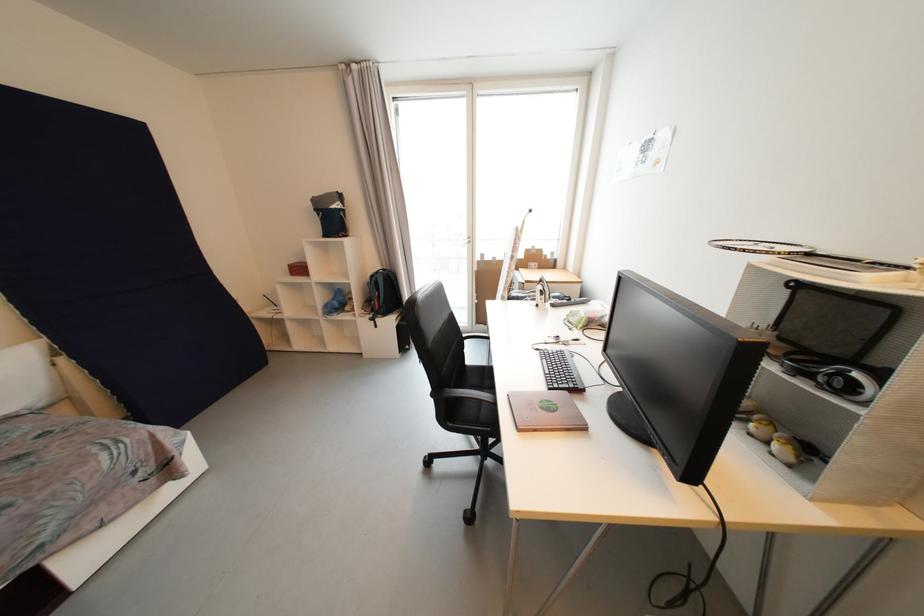
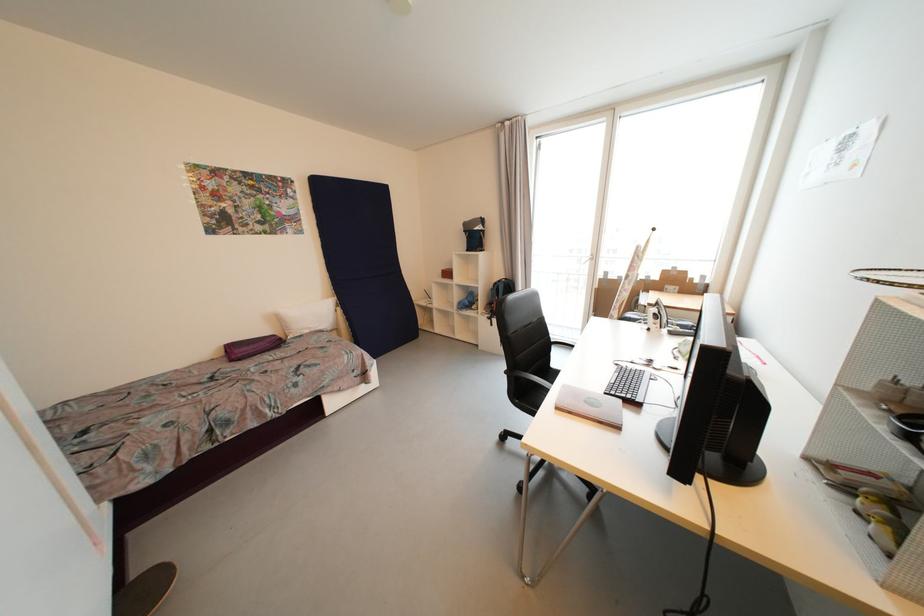
Where in the second image is the point corresponding to [297,264] from the first image?

(450, 270)